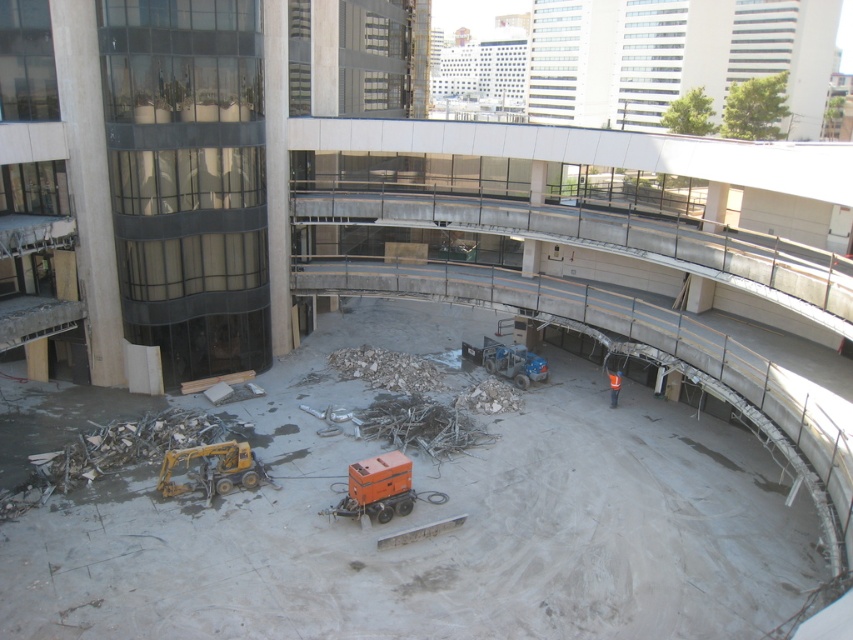
You are a construction worker who needs to move a heavy tool from the yellow metallic excavator at lower left to the concrete debris at center. What is the shortest distance you need to cover?

The shortest distance you need to cover is 5.19 meters between the yellow metallic excavator at lower left and the concrete debris at center.

You are a construction worker standing at the point labeled point (215,484) and need to move to the point labeled point (322,588). Given that the walkway is 1.5 meters wide, can you safely navigate from your current position to the target point without crossing into the debris area?

Point (322,588) is in front of point (215,484), so moving forward from your current position should allow you to reach the target point safely along the walkway, which is wide enough at 1.5 meters to avoid the debris below.